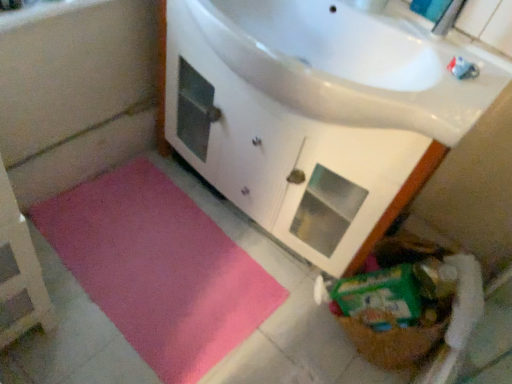
Question: Is white glossy faucet at upper center wider or thinner than pink fabric bath mat at lower left?

Choices:
 (A) thin
 (B) wide

Answer: (A)

Question: From the image's perspective, is white glossy faucet at upper center above or below pink fabric bath mat at lower left?

Choices:
 (A) below
 (B) above

Answer: (B)

Question: Based on their relative distances, which object is nearer to the pink fabric bath mat at lower left?

Choices:
 (A) white glossy faucet at upper center
 (B) white glossy cabinet at upper center
 (C) pink plush bath mat at lower left
 (D) brown woven basket at lower right

Answer: (C)

Question: Which object is positioned farthest from the pink plush bath mat at lower left?

Choices:
 (A) white glossy cabinet at upper center
 (B) white glossy faucet at upper center
 (C) pink fabric bath mat at lower left
 (D) brown woven basket at lower right

Answer: (B)